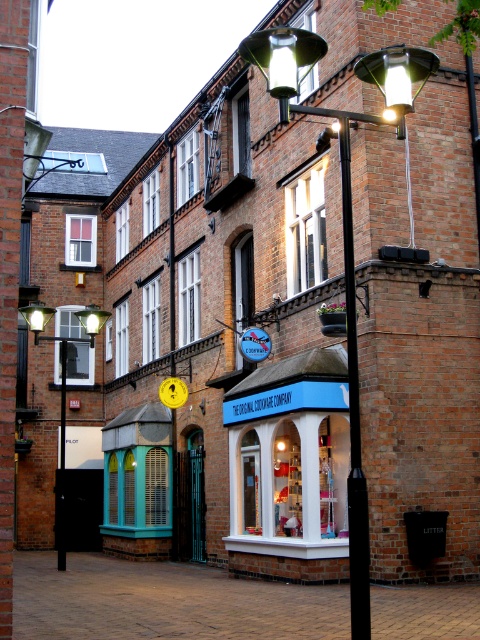
You are standing at the corner of the street and want to locate the matte blue storefront at center. According to the coordinates provided, where would you look relative to your current position?

The matte blue storefront at center is located at coordinates point (289, 468), which means it is positioned to the right and slightly below your current viewpoint.

You are a delivery person needing to park your 1.2 meter wide delivery cart. You see the brown brick pavement at lower center and the matte black street light at upper left. Which area can accommodate your cart without overlapping the street light?

The brown brick pavement at lower center has a larger width than the matte black street light at upper left, so the cart can fit on the brown brick pavement at lower center.